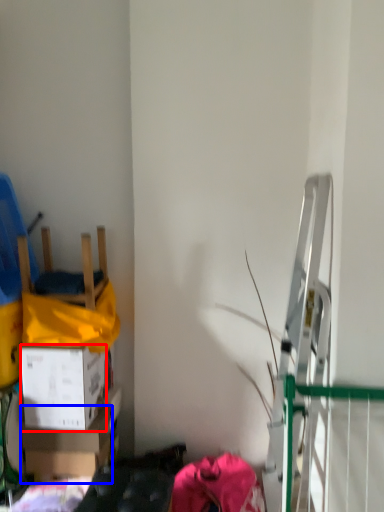
Question: Which of the following is the closest to the observer, box (highlighted by a red box) or box (highlighted by a blue box)?

Choices:
 (A) box
 (B) box

Answer: (A)